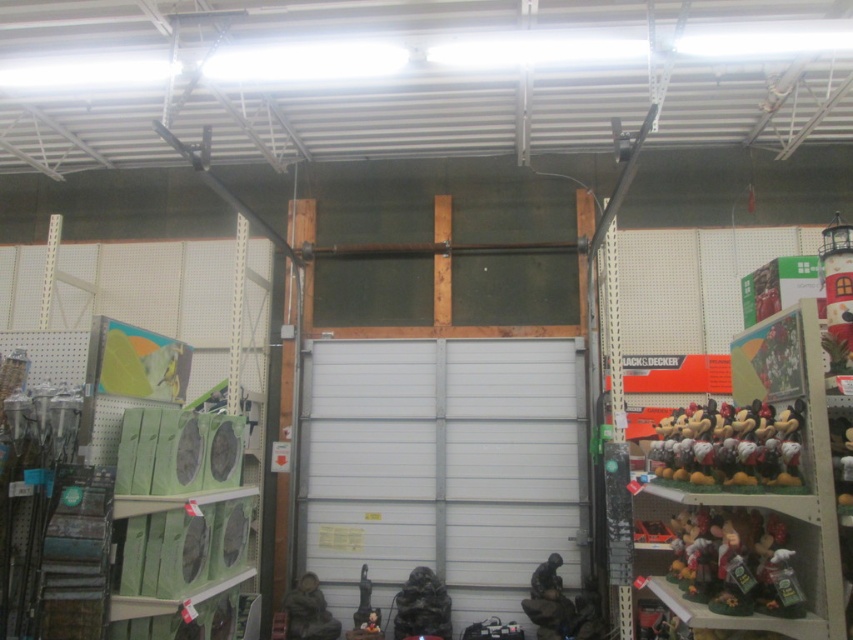
Question: Which is nearer to the black matte statue at center?

Choices:
 (A) plush mickey mouse figures at right
 (B) matte brown figurine at lower right
 (C) metallic figure at lower center
 (D) plush mickey mouse toys at right

Answer: (C)

Question: Does plush mickey mouse figures at right appear over metallic figure at lower center?

Choices:
 (A) no
 (B) yes

Answer: (B)

Question: Can you confirm if matte brown figurine at lower right is thinner than plush mickey mouse toys at right?

Choices:
 (A) yes
 (B) no

Answer: (A)

Question: Which object is positioned farthest from the metallic figure at lower center?

Choices:
 (A) plush mickey mouse figures at right
 (B) white matte garage door at center
 (C) black matte statue at center

Answer: (A)

Question: Can you confirm if black matte statue at center is wider than metallic figure at lower center?

Choices:
 (A) no
 (B) yes

Answer: (B)

Question: Among these points, which one is nearest to the camera?

Choices:
 (A) (537, 609)
 (B) (779, 452)
 (C) (433, 600)
 (D) (727, 595)

Answer: (D)